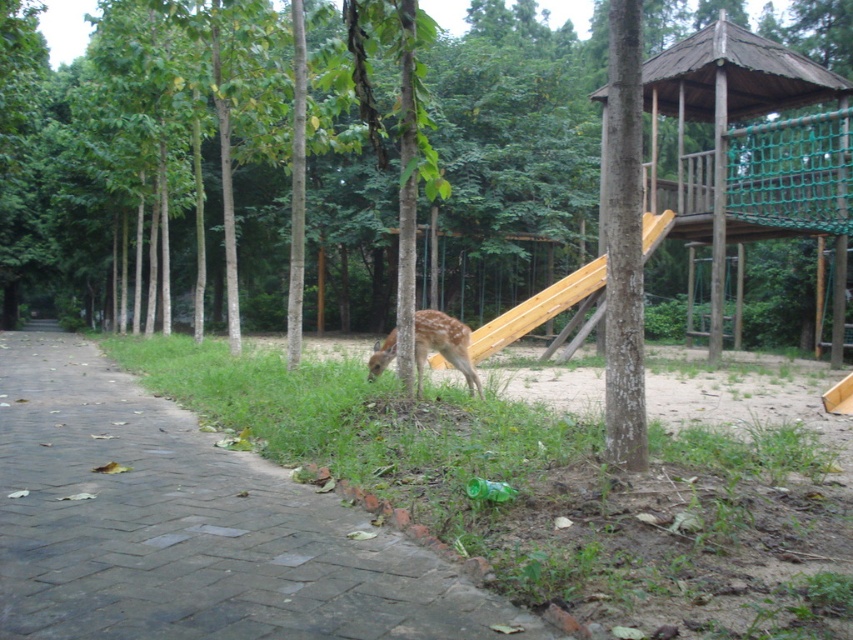
Can you confirm if brown rough tree at center is smaller than fawn fur deer at center?

Incorrect, brown rough tree at center is not smaller in size than fawn fur deer at center.

Who is positioned more to the left, brown rough tree at center or fawn fur deer at center?

brown rough tree at center is more to the left.

Between point (492, 273) and point (444, 323), which one is positioned behind?

The point (492, 273) is more distant.

The image size is (853, 640). In order to click on brown rough tree at center in this screenshot , I will do `click(132, 148)`.

Is point (299, 541) more distant than point (647, 225)?

No.

Which is in front, point (125, 582) or point (535, 310)?

Point (125, 582) is more forward.

This screenshot has width=853, height=640. Identify the location of brick paved path at center. coord(190,528).

Locate an element on the screen. Image resolution: width=853 pixels, height=640 pixels. brick paved path at center is located at coordinates (190, 528).

Describe the element at coordinates (132, 148) in the screenshot. This screenshot has height=640, width=853. I see `brown rough tree at center` at that location.

Is brown rough tree at center to the left of wooden smooth slide at center from the viewer's perspective?

Yes, brown rough tree at center is to the left of wooden smooth slide at center.

Is point (779, 141) positioned after point (567, 288)?

No, (779, 141) is closer to viewer.

This screenshot has height=640, width=853. What are the coordinates of `brown rough tree at center` in the screenshot? It's located at (132, 148).